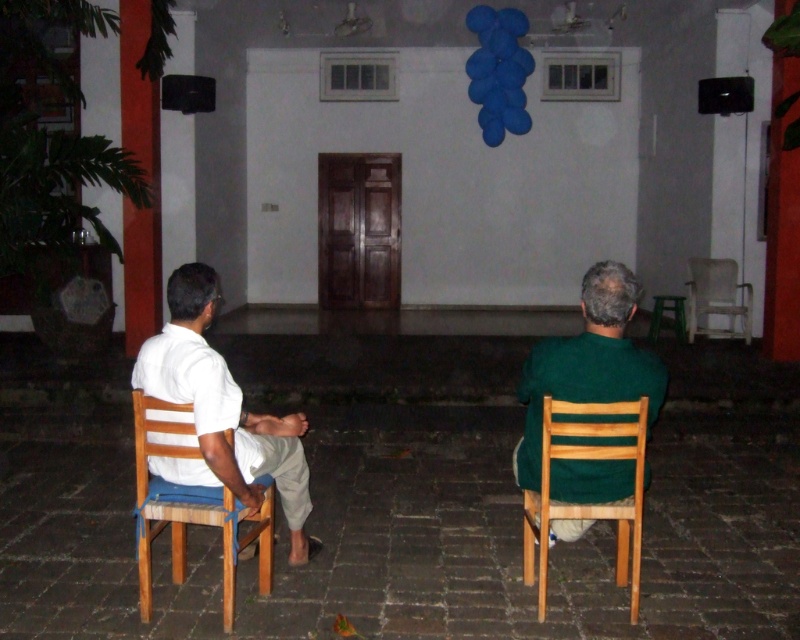
Question: Which point is closer to the camera?

Choices:
 (A) blue fuzzy ball at upper center
 (B) green plastic stool at lower right
 (C) wooden chair at right

Answer: (C)

Question: Which point is farther from the camera taking this photo?

Choices:
 (A) coord(270,577)
 (B) coord(624,429)
 (C) coord(596,296)

Answer: (A)

Question: Which object is farther from the camera taking this photo?

Choices:
 (A) green matte shirt at right
 (B) green plastic stool at lower right
 (C) wooden chair at right
 (D) white plastic chair at right

Answer: (B)

Question: Is white plastic chair at right further to camera compared to green plastic stool at lower right?

Choices:
 (A) no
 (B) yes

Answer: (A)

Question: Is blue fuzzy ball at upper center positioned in front of green plastic stool at lower right?

Choices:
 (A) no
 (B) yes

Answer: (B)

Question: Does wooden chair at left appear on the left side of blue fuzzy ball at upper center?

Choices:
 (A) no
 (B) yes

Answer: (B)